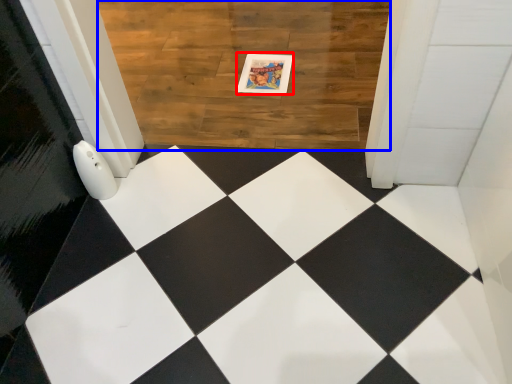
Question: Which object appears closest to the camera in this image, postcard (highlighted by a red box) or square (highlighted by a blue box)?

Choices:
 (A) postcard
 (B) square

Answer: (B)